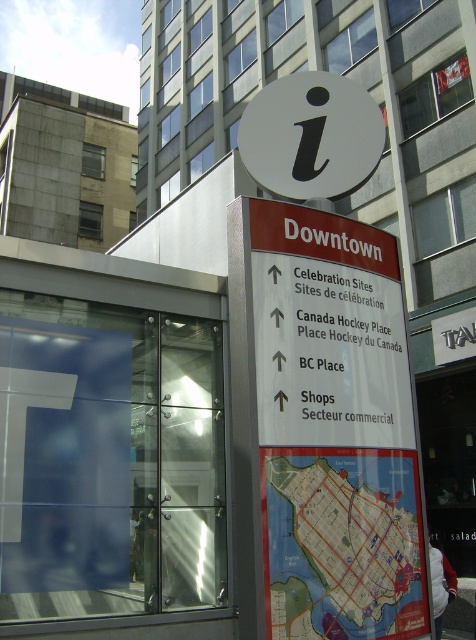
Question: Is map at center positioned behind white matte sign at center?

Choices:
 (A) no
 (B) yes

Answer: (A)

Question: Is map at center to the right of white matte sign at center from the viewer's perspective?

Choices:
 (A) no
 (B) yes

Answer: (B)

Question: Which point is farther to the camera?

Choices:
 (A) (298, 128)
 (B) (310, 465)

Answer: (A)

Question: Observing the image, what is the correct spatial positioning of map at center in reference to white matte sign at center?

Choices:
 (A) below
 (B) above

Answer: (A)